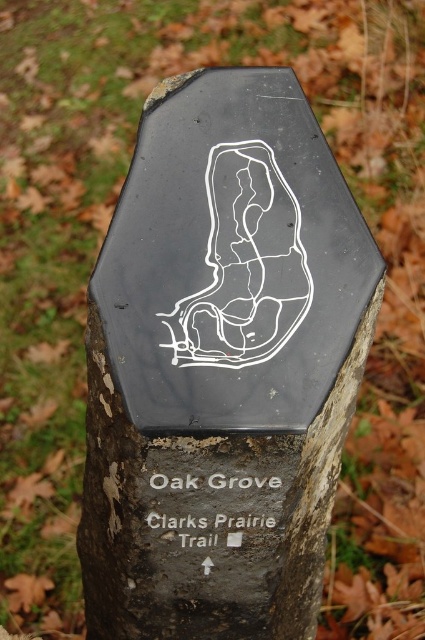
You are standing in front of the trail marker and want to touch both points. Which point should you reach for first, point (300, 547) or point (215, 481)?

You should reach for point (300, 547) first because it is closer to you than point (215, 481).